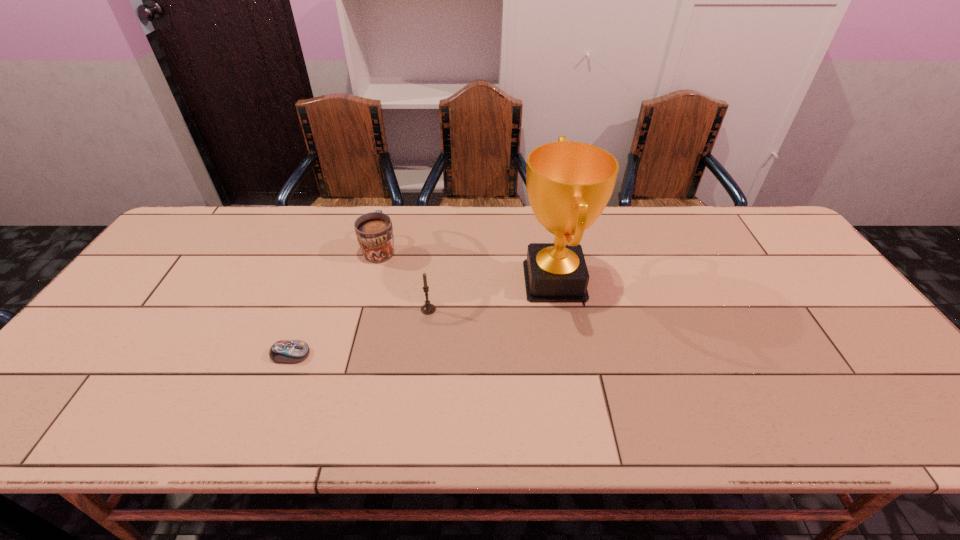
Locate an element on the screen. This screenshot has height=540, width=960. award is located at coordinates (569, 184).

The height and width of the screenshot is (540, 960). Find the location of `the rightmost object`. the rightmost object is located at coordinates (569, 184).

What are the coordinates of `the second object from right to left` in the screenshot? It's located at (427, 309).

Identify the location of the second object from left to right. (374, 231).

This screenshot has height=540, width=960. I want to click on the shortest object, so pyautogui.click(x=284, y=351).

The width and height of the screenshot is (960, 540). What are the coordinates of `the leftmost object` in the screenshot? It's located at (284, 351).

Locate an element on the screen. The height and width of the screenshot is (540, 960). vacant space situated on the front-facing side of the rightmost object is located at coordinates (458, 281).

Where is `vacant space located on the front-facing side of the rightmost object`? This screenshot has width=960, height=540. vacant space located on the front-facing side of the rightmost object is located at coordinates (405, 281).

Identify the location of vacant space located 0.270m on the front-facing side of the rightmost object. (423, 281).

Locate an element on the screen. vacant space located 0.050m on the right of the candle is located at coordinates pos(454,309).